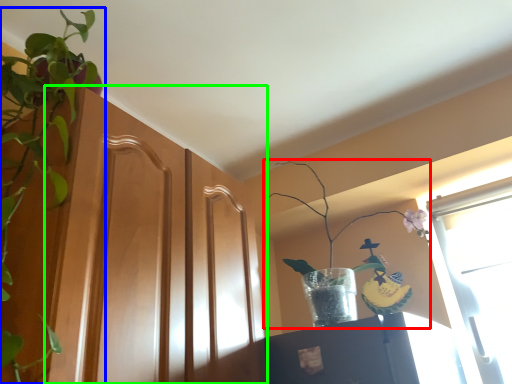
Question: Considering the real-world distances, which object is farthest from houseplant (highlighted by a red box)? houseplant (highlighted by a blue box) or screen door (highlighted by a green box)?

Choices:
 (A) houseplant
 (B) screen door

Answer: (A)